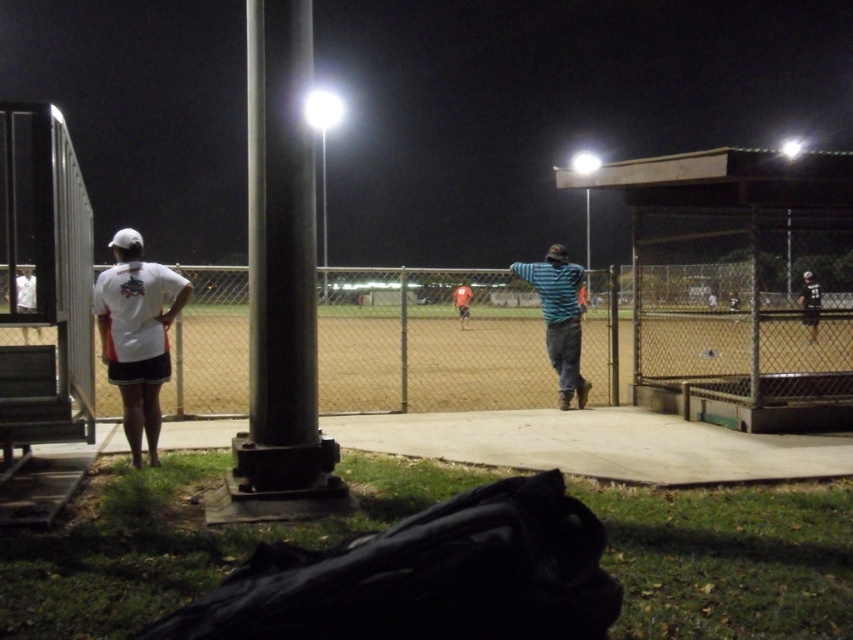
Does black metallic pole at center appear on the left side of striped cotton shirt at center?

Indeed, black metallic pole at center is positioned on the left side of striped cotton shirt at center.

From the picture: Which of these two, black metallic pole at center or striped cotton shirt at center, stands taller?

black metallic pole at center is taller.

The height and width of the screenshot is (640, 853). Describe the element at coordinates (281, 276) in the screenshot. I see `black metallic pole at center` at that location.

Identify the location of black metallic pole at center. (281, 276).

Is the position of striped cotton shirt at center less distant than that of red fabric shirt at center?

That is True.

Can you confirm if striped cotton shirt at center is shorter than red fabric shirt at center?

Incorrect, striped cotton shirt at center's height does not fall short of red fabric shirt at center's.

Identify the location of striped cotton shirt at center. This screenshot has height=640, width=853. (560, 317).

Where is `striped cotton shirt at center`? striped cotton shirt at center is located at coordinates (560, 317).

Is point (308, 440) more distant than point (146, 262)?

No, (308, 440) is closer to viewer.

Between point (283, 273) and point (157, 356), which one is positioned in front?

Point (283, 273) is in front.

The height and width of the screenshot is (640, 853). Find the location of `black metallic pole at center`. black metallic pole at center is located at coordinates (281, 276).